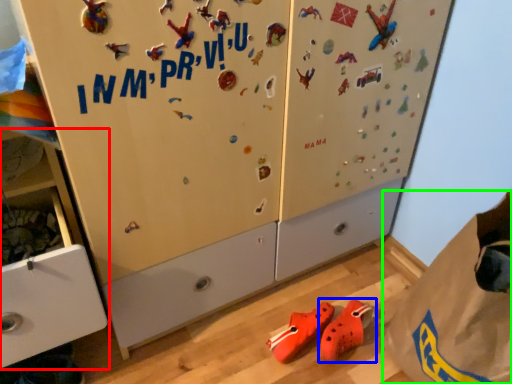
Question: Based on their relative distances, which object is nearer to cabinetry (highlighted by a red box)? Choose from footwear (highlighted by a blue box) and paper bag (highlighted by a green box).

Choices:
 (A) footwear
 (B) paper bag

Answer: (A)